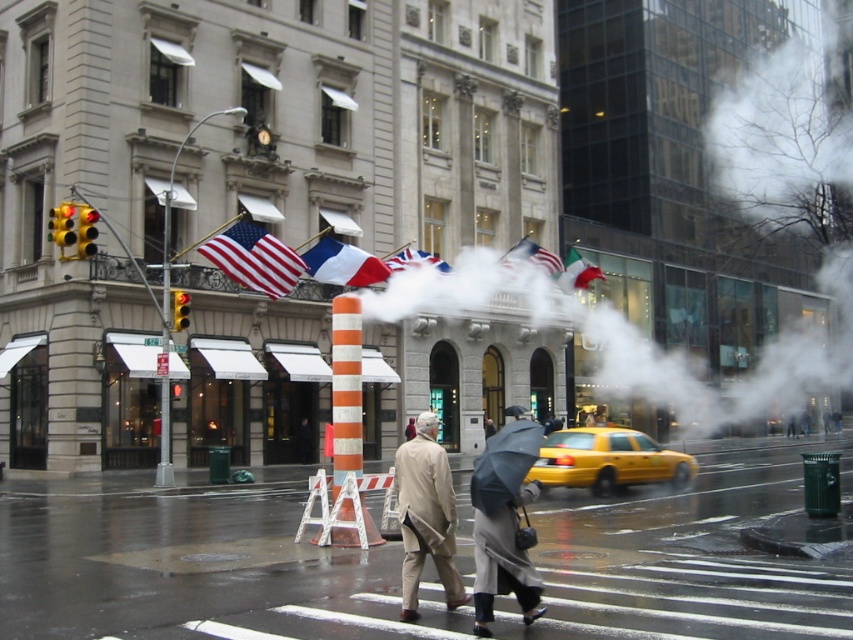
You are a delivery person trying to protect your package from the rain. You have a dark gray wool coat at center and a black matte umbrella at center. Which item is wider, allowing it to provide better coverage for your package?

The black matte umbrella at center is wider than the dark gray wool coat at center, so it would provide better coverage for your package.

You are a pedestrian standing on the sidewalk in the urban street scene. You notice two flags, the matte white flag at center and the matte green flag at center. Which flag is positioned higher in the scene?

The matte white flag at center is above the matte green flag at center, so the matte white flag at center is positioned higher.

You are standing on the sidewalk and want to walk towards the two points marked in the image. Which point, point (496, 513) or point (494, 468), will you reach first?

You will reach point (496, 513) first because it is closer to you than point (494, 468), which is further away.